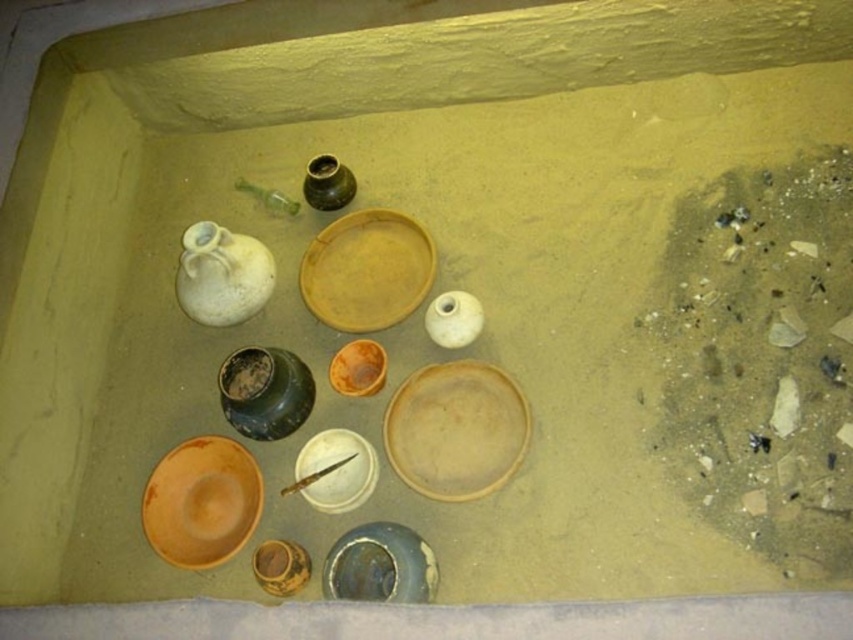
You are an archaeologist examining the items in the excavation pit. You need to determine which of the two central items, the matte brown ceramic basin at center or the white matte plate at center, is taller. Which one is taller?

The white matte plate at center is taller than the matte brown ceramic basin at center.

You are an archaeologist examining the ancient pottery items in the excavation pit. You need to determine which object has a greater width between the matte brown ceramic basin at center and the white matte bottle at upper left. Based on the spatial details provided, which one is wider?

The matte brown ceramic basin at center has a greater width compared to the white matte bottle at upper left as stated in the description.